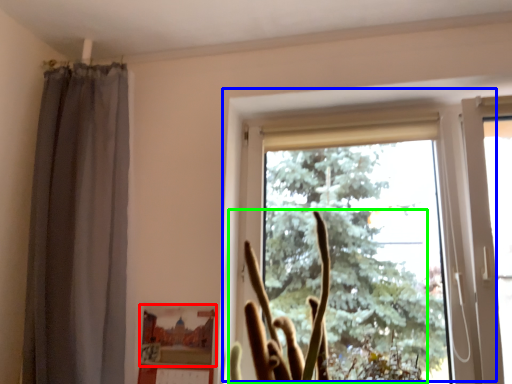
Question: Which is nearer to the picture frame (highlighted by a red box)? window (highlighted by a blue box) or plant (highlighted by a green box).

Choices:
 (A) window
 (B) plant

Answer: (B)